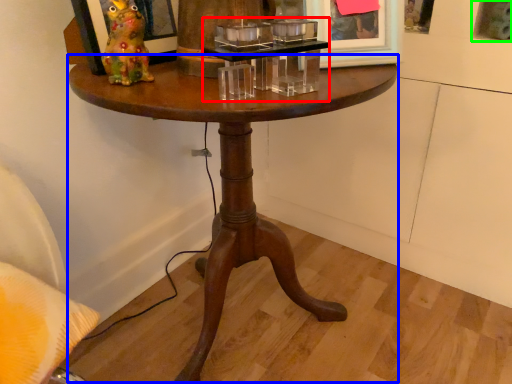
Question: Considering the real-world distances, which object is farthest from candle holder (highlighted by a red box)? coffee table (highlighted by a blue box) or picture frame (highlighted by a green box)?

Choices:
 (A) coffee table
 (B) picture frame

Answer: (B)